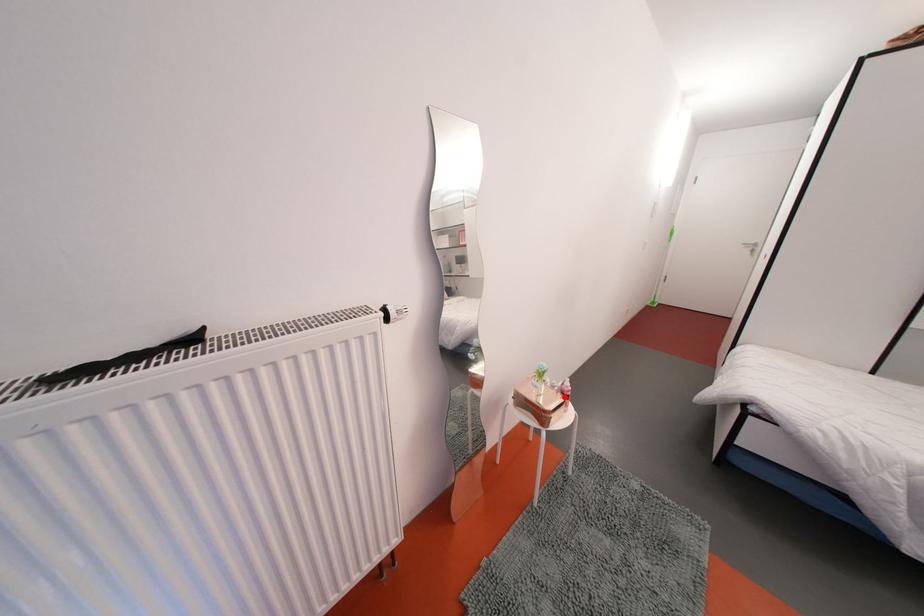
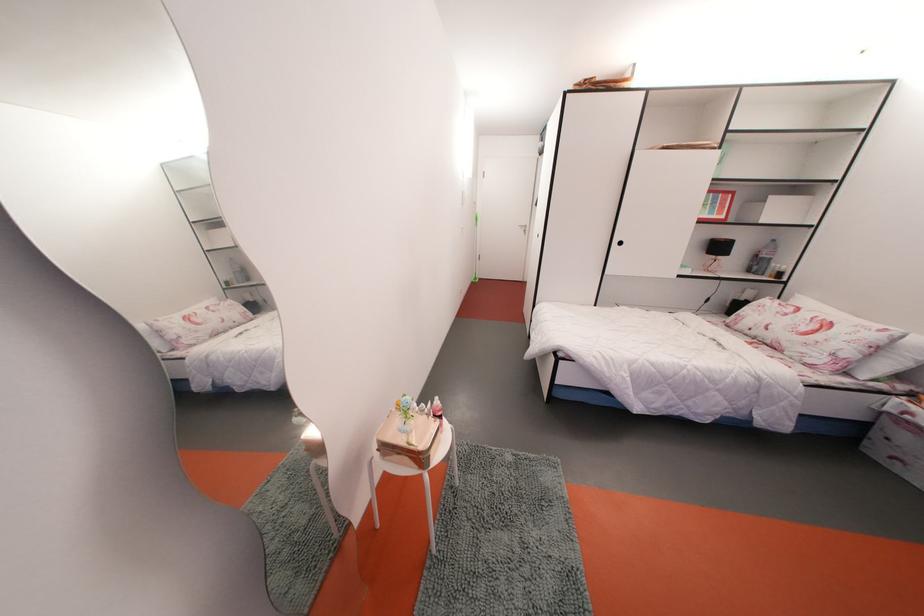
Where in the second image is the point corresponding to the highlighted location from the first image?

(435, 419)